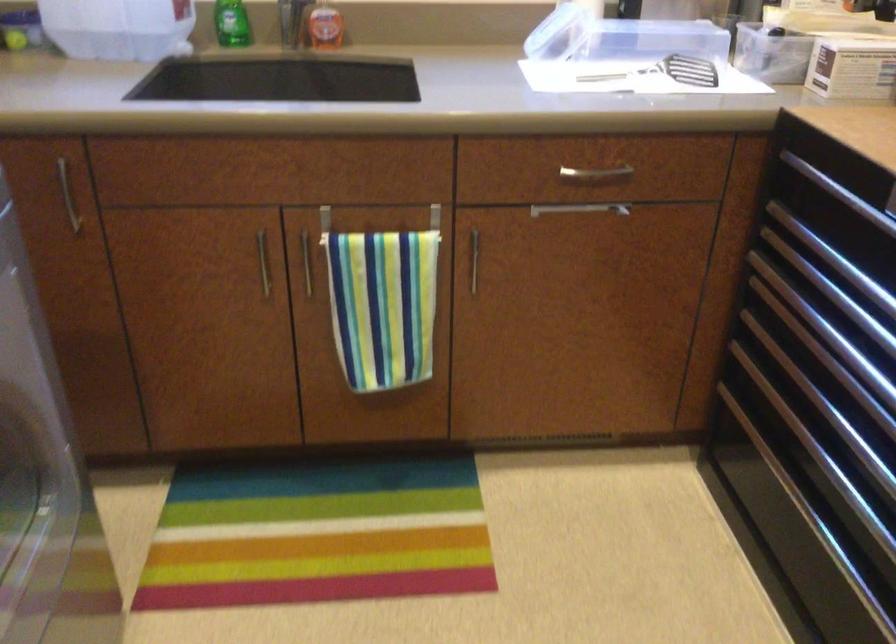
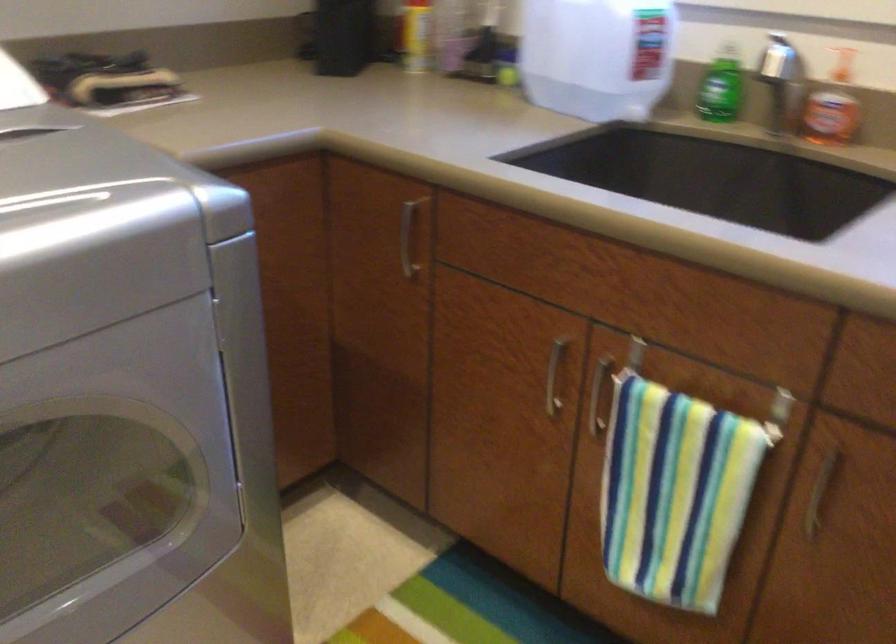
Find the pixel in the second image that matches (x=468, y=263) in the first image.

(819, 494)